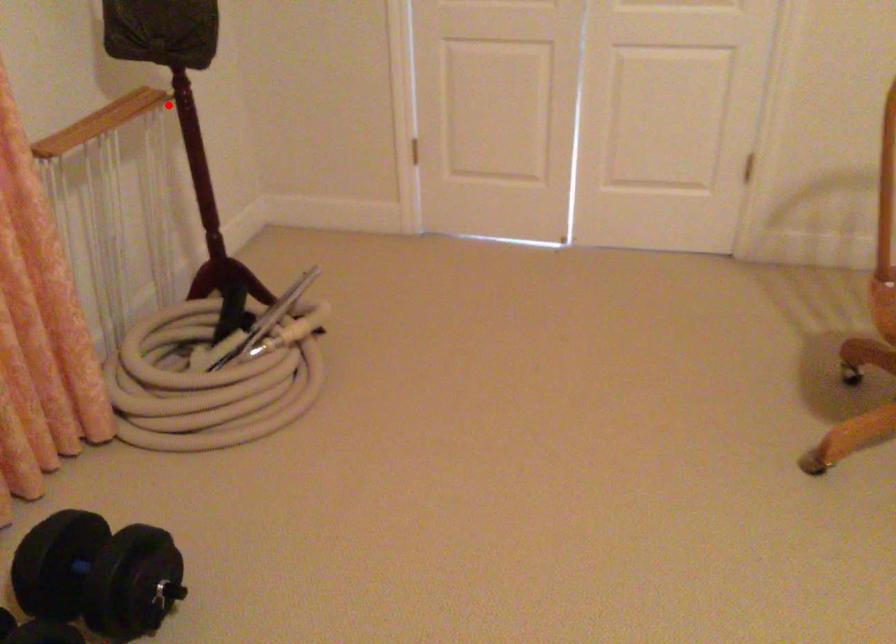
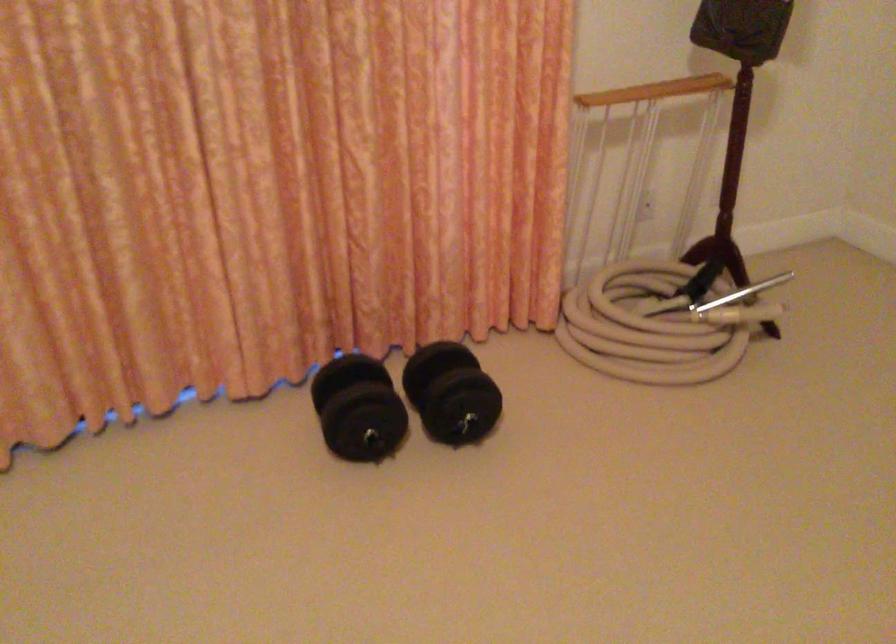
Find the pixel in the second image that matches the highlighted location in the first image.

(711, 78)